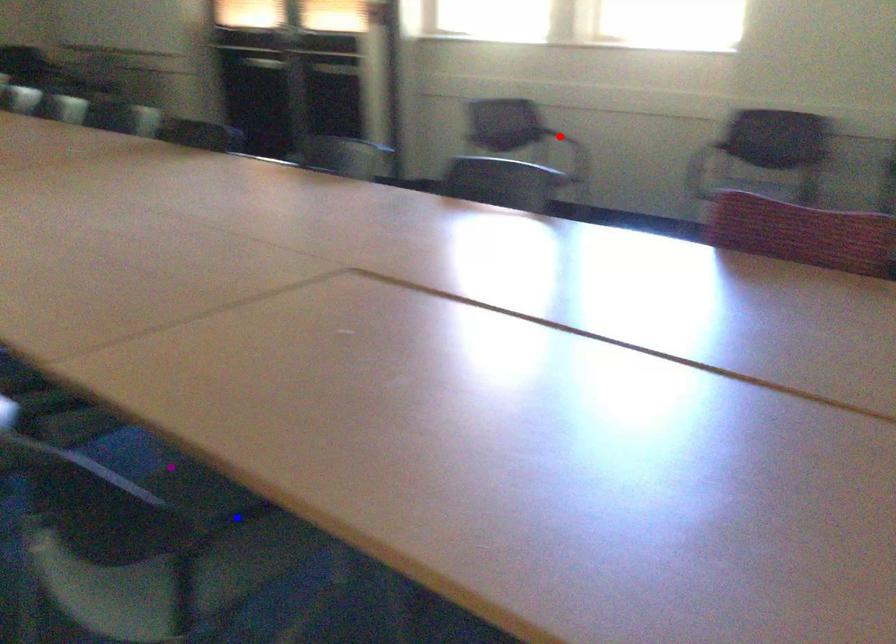
Order these from nearest to farthest:
- blue point
- red point
- purple point

1. blue point
2. purple point
3. red point